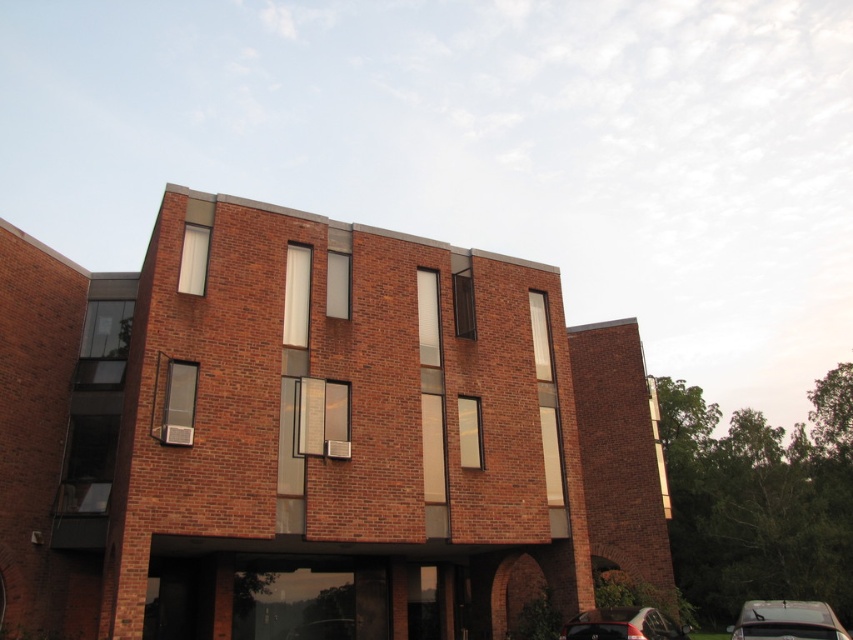
Is point (816, 620) positioned in front of point (659, 627)?

Yes, it is in front of point (659, 627).

Who is more distant from viewer, (772, 614) or (628, 609)?

The point (628, 609) is more distant.

Locate an element on the screen. metallic silver car at lower right is located at coordinates (786, 620).